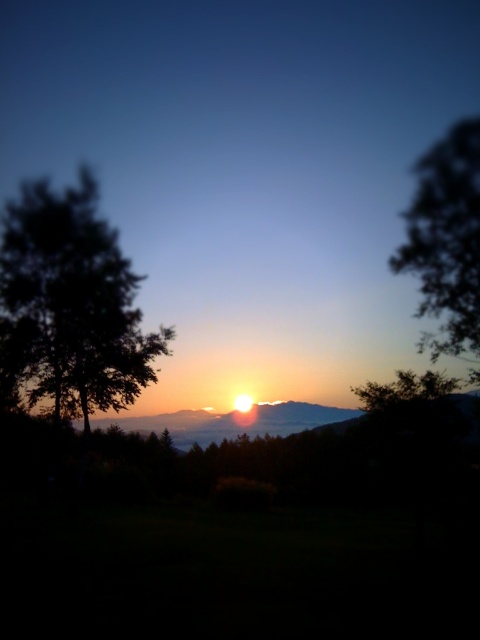
Question: Is dark green leafy tree at left to the right of silhouette leafy tree at right from the viewer's perspective?

Choices:
 (A) yes
 (B) no

Answer: (B)

Question: Which of the following is the closest to the observer?

Choices:
 (A) silhouette leafy tree at right
 (B) dark green leafy tree at left

Answer: (A)

Question: Is dark green leafy tree at left in front of silhouette leafy tree at right?

Choices:
 (A) no
 (B) yes

Answer: (A)

Question: Which of the following is the farthest from the observer?

Choices:
 (A) dark green leafy tree at left
 (B) silhouette leafy tree at right

Answer: (A)

Question: In this image, where is dark green leafy tree at left located relative to silhouette leafy tree at right?

Choices:
 (A) right
 (B) left

Answer: (B)